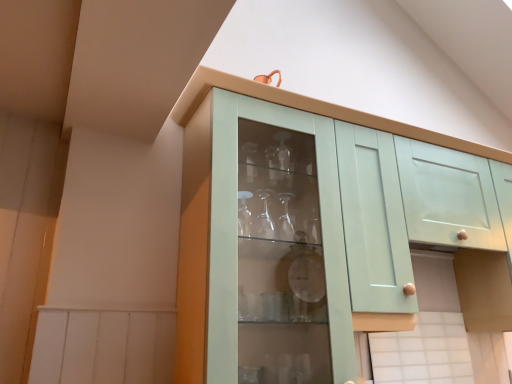
This screenshot has height=384, width=512. What do you see at coordinates (234, 225) in the screenshot? I see `matte green cabinet at upper center` at bounding box center [234, 225].

This screenshot has width=512, height=384. Find the location of `matte green cabinet at upper center`. matte green cabinet at upper center is located at coordinates (234, 225).

Measure the distance between matte green cabinet at upper center and camera.

matte green cabinet at upper center and camera are 3.68 feet apart.

Identify the location of matte green cabinet at upper center. (234, 225).